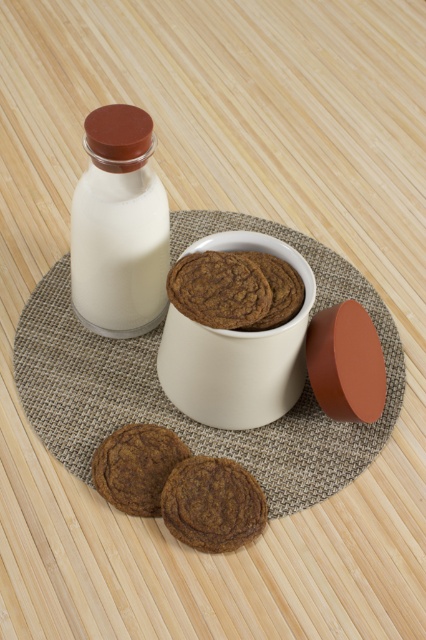
Question: Estimate the real-world distances between objects in this image. Which object is farther from the brown matte cookie at lower center?

Choices:
 (A) white glossy bottle at upper left
 (B) brown matte cookie at center
 (C) textured beige placemat at center

Answer: (A)

Question: Is textured beige placemat at center behind brown matte cookie at center?

Choices:
 (A) no
 (B) yes

Answer: (B)

Question: Does brown matte cookie at lower center have a larger size compared to brown matte cookie at center?

Choices:
 (A) no
 (B) yes

Answer: (A)

Question: Which object appears closest to the camera in this image?

Choices:
 (A) matte white bowl at center
 (B) chocolate chip cookie at lower left
 (C) brown matte cookie at center
 (D) white glossy bottle at upper left

Answer: (A)

Question: Is textured beige placemat at center wider than brown matte cookie at lower center?

Choices:
 (A) no
 (B) yes

Answer: (B)

Question: Estimate the real-world distances between objects in this image. Which object is farther from the textured beige placemat at center?

Choices:
 (A) chocolate chip cookie at lower left
 (B) white glossy bottle at upper left

Answer: (A)